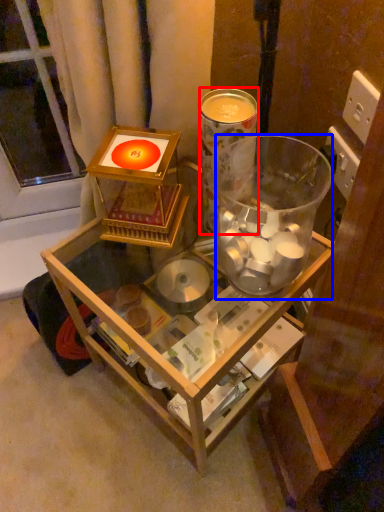
Question: Which point is further to the camera, beverage (highlighted by a red box) or beverage (highlighted by a blue box)?

Choices:
 (A) beverage
 (B) beverage

Answer: (A)